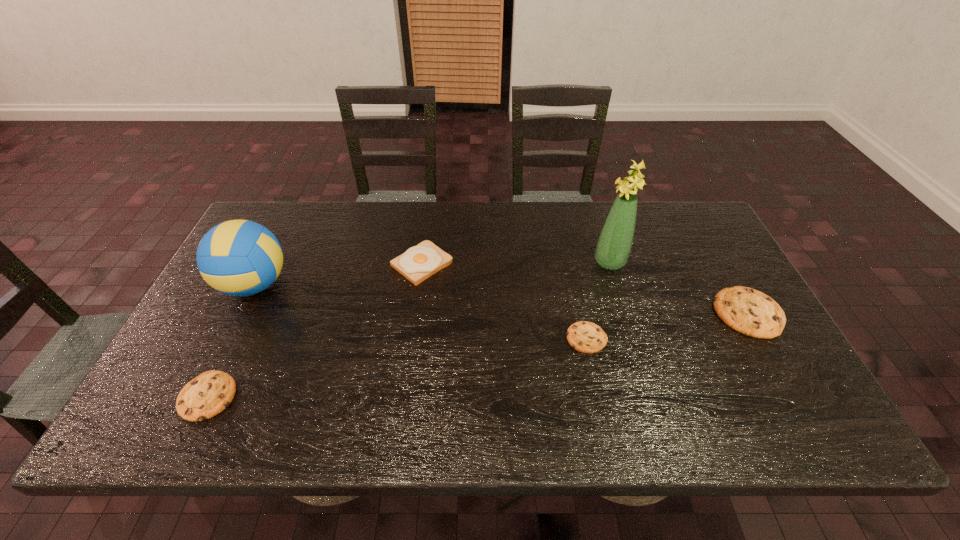
Image resolution: width=960 pixels, height=540 pixels. In order to click on cookie located in the left edge section of the desktop in this screenshot , I will do `click(207, 395)`.

Locate an element on the screen. volleyball that is at the left edge is located at coordinates (238, 257).

The image size is (960, 540). What are the coordinates of `object that is positioned at the right edge` in the screenshot? It's located at (748, 311).

Locate an element on the screen. object present at the near left corner is located at coordinates click(207, 395).

In order to click on free region at the far edge in this screenshot , I will do `click(326, 204)`.

Identify the location of vacant point at the near edge. (300, 386).

Image resolution: width=960 pixels, height=540 pixels. What are the coordinates of `free location at the near left corner` in the screenshot? It's located at (172, 395).

I want to click on vacant space that's between the tallest cookie and the shortest object, so click(x=667, y=326).

Find the location of a particular element. The image size is (960, 540). vacant space that's between the rightmost cookie and the third object from left to right is located at coordinates (585, 288).

The height and width of the screenshot is (540, 960). What are the coordinates of `free space between the fourth object from right to left and the second object from right to left` in the screenshot? It's located at (516, 263).